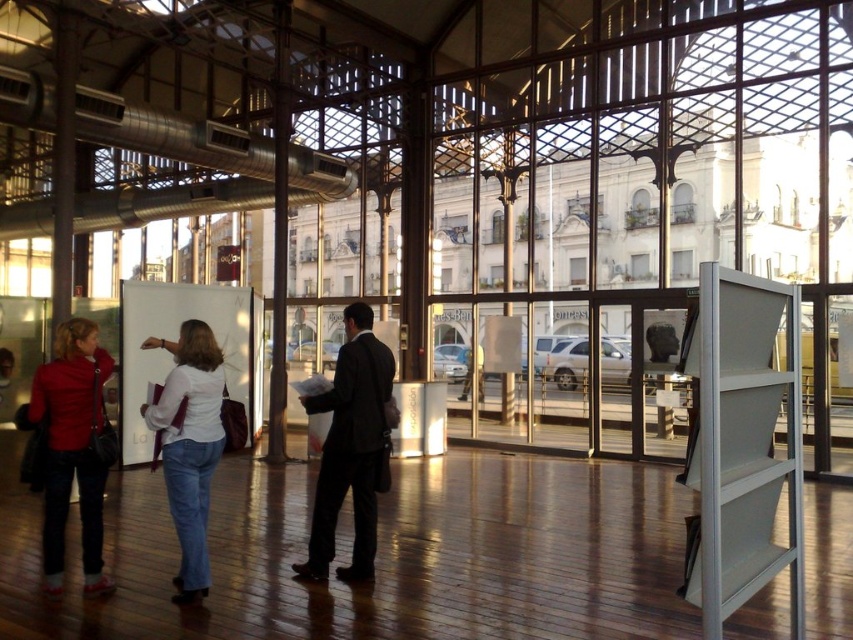
Who is taller, dark suit at center or white matte shirt at center?

dark suit at center is taller.

Can you confirm if dark suit at center is wider than white matte shirt at center?

No.

Who is more distant from viewer, (x=325, y=524) or (x=178, y=481)?

Point (x=325, y=524)

Where is `dark suit at center`? The height and width of the screenshot is (640, 853). dark suit at center is located at coordinates (352, 449).

Which is behind, point (80, 401) or point (204, 451)?

The point (80, 401) is behind.

Can you confirm if matte red jacket at left is thinner than white matte shirt at center?

Correct, matte red jacket at left's width is less than white matte shirt at center's.

Identify the location of matte red jacket at left. (73, 449).

What do you see at coordinates (352, 449) in the screenshot? I see `dark suit at center` at bounding box center [352, 449].

Which is behind, point (386, 356) or point (73, 376)?

Positioned behind is point (386, 356).

The image size is (853, 640). Identify the location of dark suit at center. (352, 449).